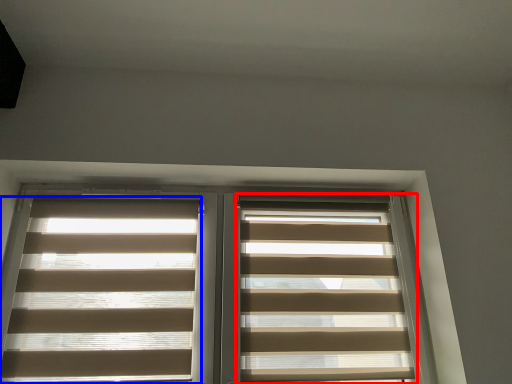
Question: Which object is closer to the camera taking this photo, window blind (highlighted by a red box) or window blind (highlighted by a blue box)?

Choices:
 (A) window blind
 (B) window blind

Answer: (B)